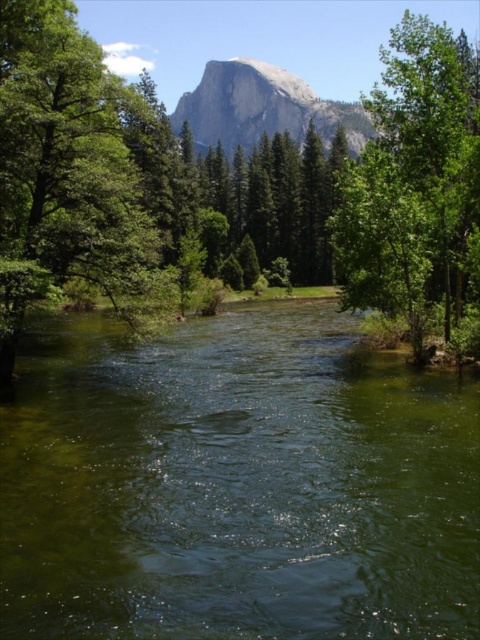
Question: Which point is closer to the camera?

Choices:
 (A) green liquid water at center
 (B) green leafy tree at center
 (C) green leafy tree at right

Answer: (A)

Question: Is green liquid water at center wider than green leafy tree at center?

Choices:
 (A) yes
 (B) no

Answer: (B)

Question: Can you confirm if green leafy tree at center is positioned below granite rock formation at upper center?

Choices:
 (A) no
 (B) yes

Answer: (B)

Question: Which of these objects is positioned farthest from the green leafy tree at right?

Choices:
 (A) green liquid water at center
 (B) granite rock formation at upper center

Answer: (B)

Question: Based on their relative distances, which object is nearer to the green leafy tree at center?

Choices:
 (A) green liquid water at center
 (B) granite rock formation at upper center

Answer: (A)

Question: Does green liquid water at center have a larger size compared to green leafy tree at right?

Choices:
 (A) yes
 (B) no

Answer: (B)